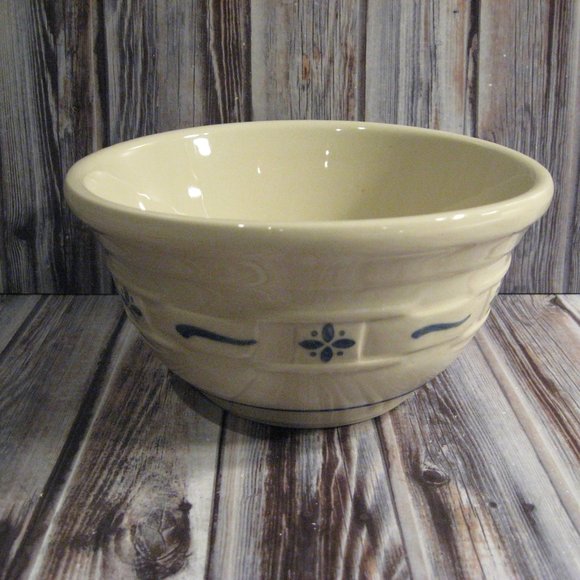
Identify the location of light reflecting off bowl. This screenshot has height=580, width=580. tap(192, 192), tap(203, 144), tap(325, 162), tap(327, 154), tap(336, 130), tap(361, 128), tap(258, 169), tap(147, 198), tap(140, 206), tap(240, 227).